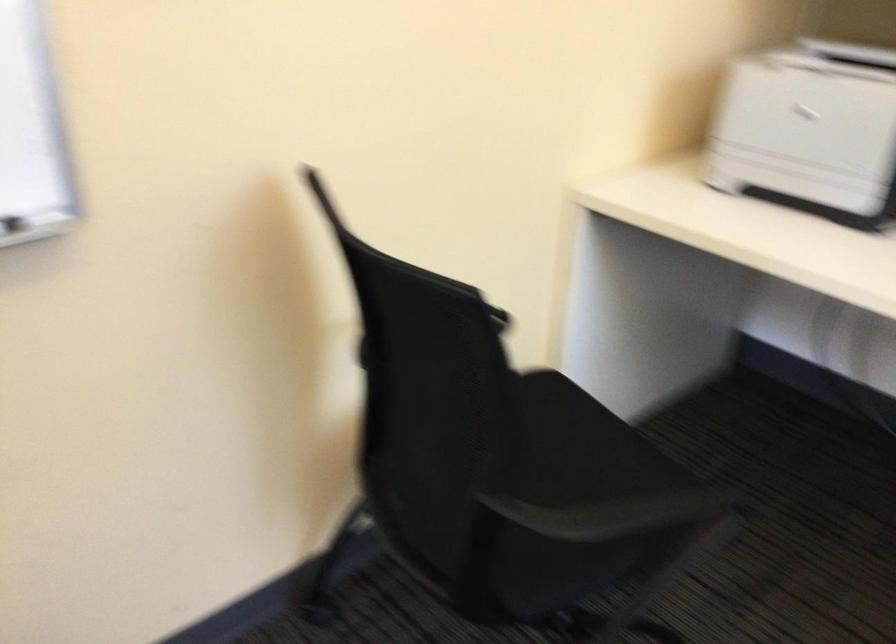
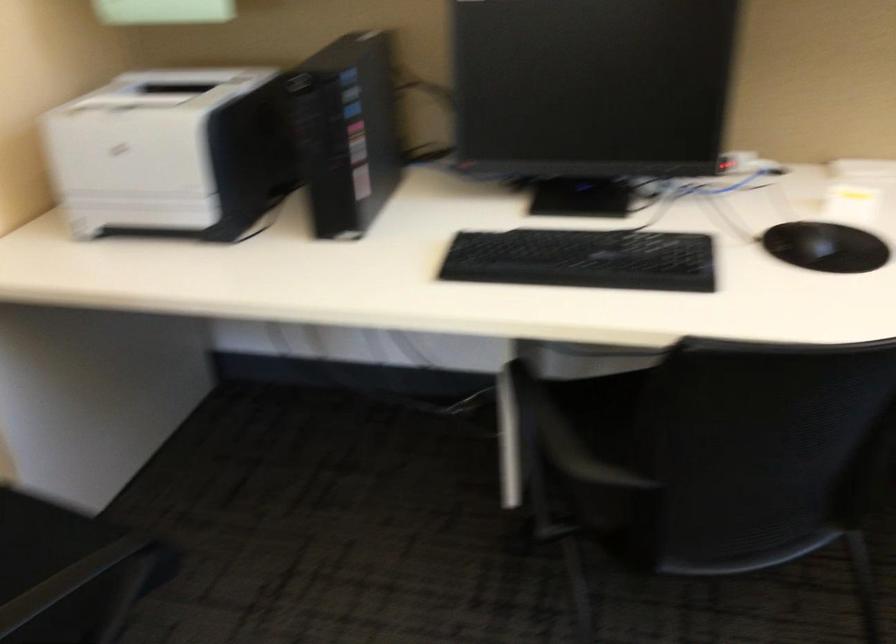
Question: The camera is either moving clockwise (left) or counter-clockwise (right) around the object. The first image is from the beginning of the video and the second image is from the end. Is the camera moving left or right when shooting the video?

Choices:
 (A) Left
 (B) Right

Answer: (A)